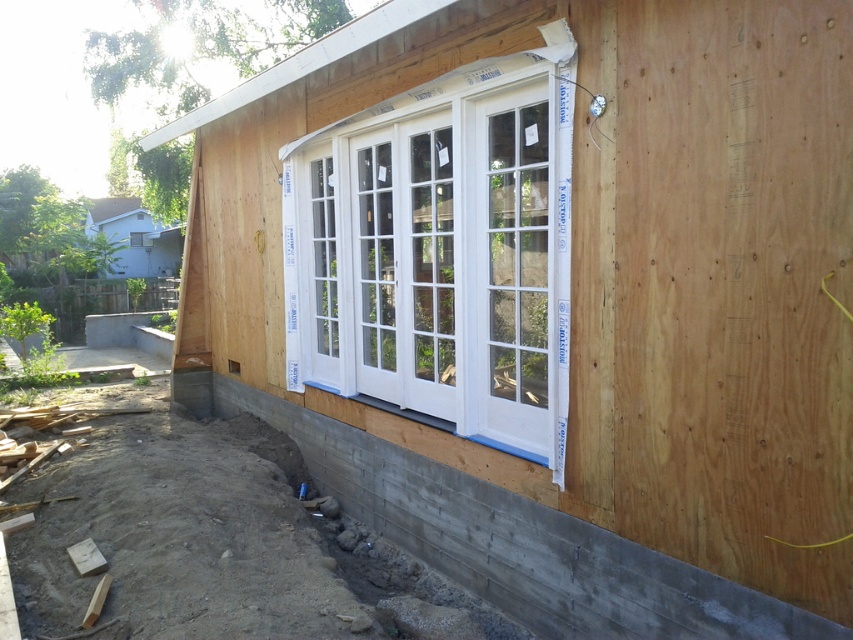
Which is above, white painted wood bay window at center or concrete at lower left?

Positioned higher is white painted wood bay window at center.

Does point (555, 248) come behind point (811, 634)?

That is True.

The image size is (853, 640). Identify the location of white painted wood bay window at center. (440, 253).